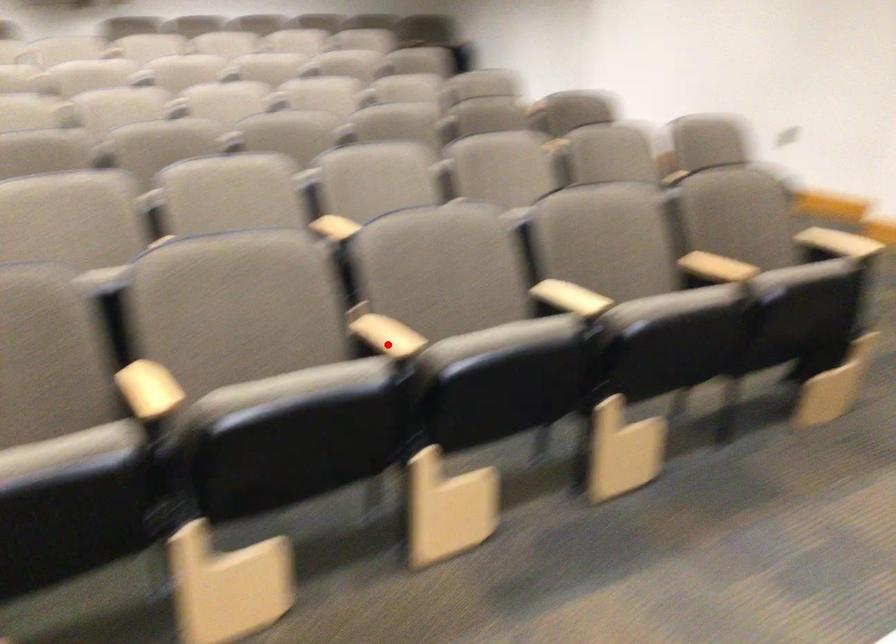
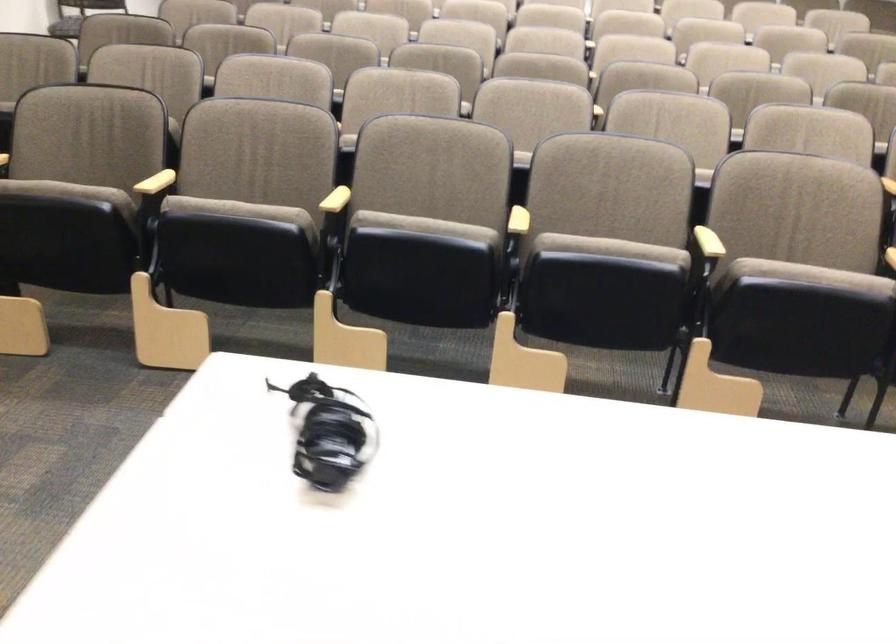
Question: A red point is marked in image1. In image2, is the corresponding 3D point closer to the camera or farther? Reply with the corresponding letter.

Choices:
 (A) The corresponding 3D point is closer.
 (B) The corresponding 3D point is farther.

Answer: (B)